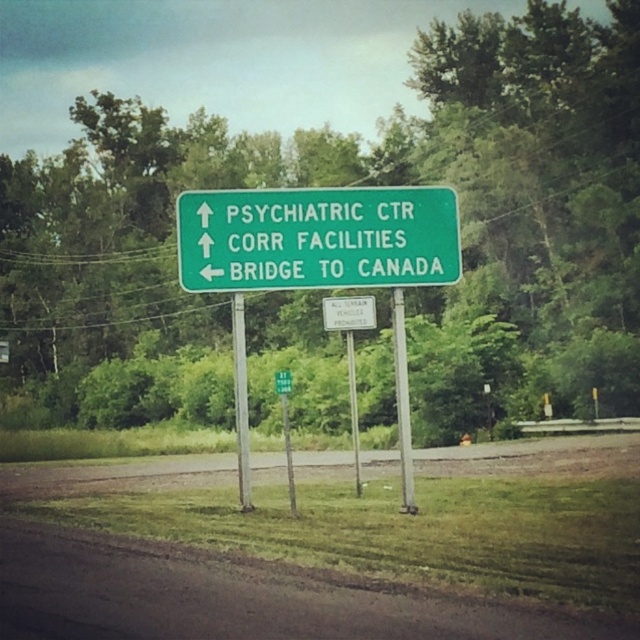
You are a delivery driver who needs to attach a GPS tracker to the white plastic sign at center. The GPS tracker must be placed within 30 feet of the green metal pole at center to ensure a strong signal. Can you safely attach the tracker to the sign?

The white plastic sign at center is 30.52 feet away from the green metal pole at center. Since the required distance for the GPS tracker is within 30 feet, the tracker cannot be attached to the sign and still maintain a strong signal.

You are a delivery driver who needs to attach a new banner to the green matte sign at center and the silver metallic pole at center. The banner you have is 1 meter wide. Will the banner fit on both objects without overlapping?

The green matte sign at center has a width less than the silver metallic pole at center. Since the banner is 1 meter wide, it may fit on the pole but not the sign. However, since the sign is narrower, the banner might overlap or not fit properly. Please check the exact measurements.